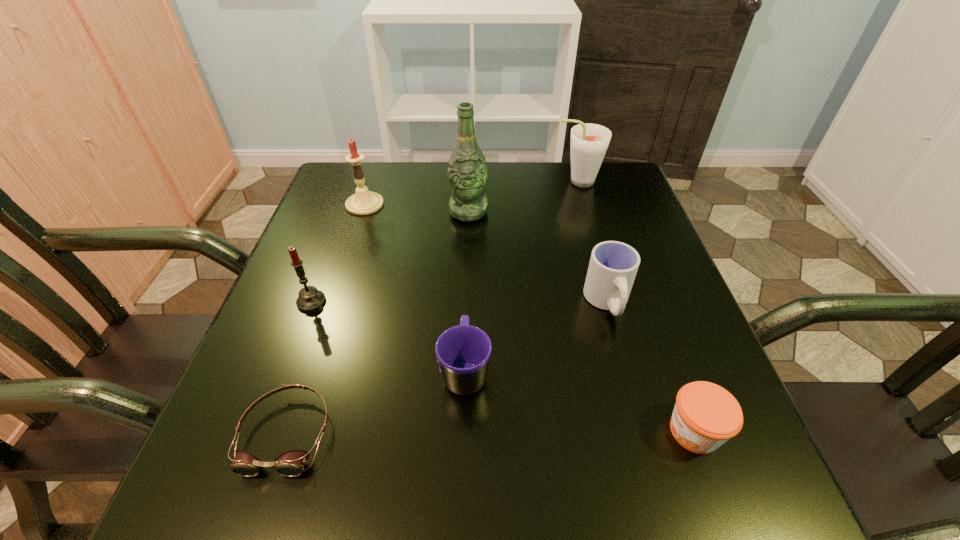
Image resolution: width=960 pixels, height=540 pixels. In order to click on cup that is at the right edge in this screenshot , I will do `click(613, 266)`.

In order to click on jam located at the right edge in this screenshot , I will do `click(705, 416)`.

This screenshot has height=540, width=960. What are the coordinates of `object present at the far left corner` in the screenshot? It's located at (364, 202).

Locate an element on the screen. The width and height of the screenshot is (960, 540). object that is at the near left corner is located at coordinates (291, 463).

Find the location of a particular element. This screenshot has width=960, height=540. object present at the far right corner is located at coordinates (589, 142).

Find the location of a particular element. Image resolution: width=960 pixels, height=540 pixels. object that is at the near right corner is located at coordinates (705, 416).

The height and width of the screenshot is (540, 960). Find the location of `free space at the far edge of the desktop`. free space at the far edge of the desktop is located at coordinates (395, 194).

Where is `vacant space at the near edge of the desktop`? vacant space at the near edge of the desktop is located at coordinates (632, 506).

I want to click on free region at the left edge of the desktop, so click(265, 379).

What are the coordinates of `free space at the right edge` in the screenshot? It's located at (628, 229).